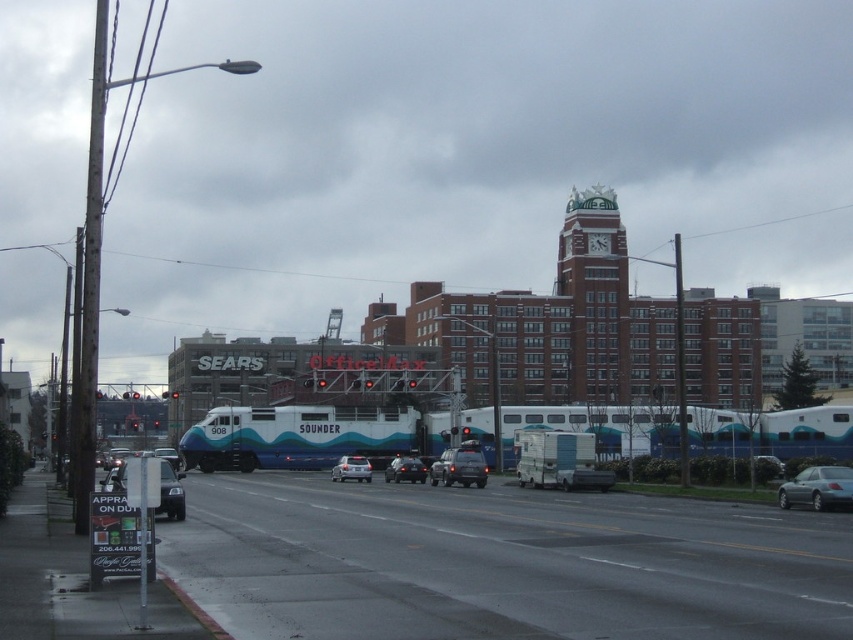
Describe the element at coordinates (595, 296) in the screenshot. I see `white brick clock tower at center` at that location.

Can you confirm if white brick clock tower at center is thinner than silver metallic sedan at center?

No.

The image size is (853, 640). In order to click on white brick clock tower at center in this screenshot , I will do `click(595, 296)`.

Where is `white brick clock tower at center`? This screenshot has height=640, width=853. white brick clock tower at center is located at coordinates (595, 296).

How much distance is there between white brick clock tower at center and silver metallic sedan at lower right?

white brick clock tower at center is 328.90 feet from silver metallic sedan at lower right.

Does point (614, 273) lie behind point (831, 500)?

Yes, point (614, 273) is farther from viewer.

Who is more distant from viewer, (599, 298) or (781, 496)?

Positioned behind is point (599, 298).

At what (x,y) coordinates should I click in order to perform the action: click on white brick clock tower at center. Please return your answer as a coordinate pair (x, y). Looking at the image, I should click on (595, 296).

Does shiny black sedan at center come behind silver metallic sedan at center?

Yes, shiny black sedan at center is behind silver metallic sedan at center.

Can you confirm if shiny black sedan at center is positioned to the left of silver metallic sedan at center?

In fact, shiny black sedan at center is to the right of silver metallic sedan at center.

Locate an element on the screen. shiny black sedan at center is located at coordinates (405, 470).